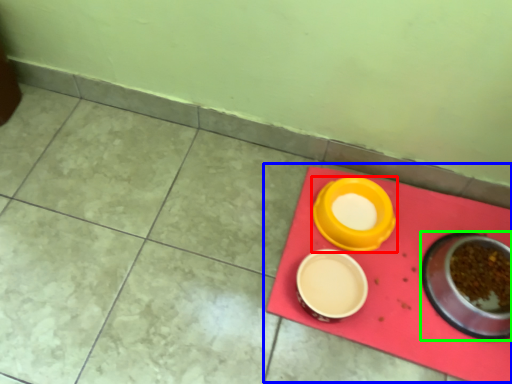
Question: Which object is positioned closest to tableware (highlighted by a red box)? Select from table (highlighted by a blue box) and tableware (highlighted by a green box).

Choices:
 (A) table
 (B) tableware

Answer: (A)